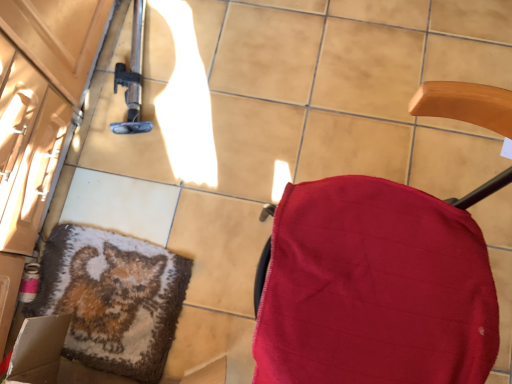
What is the approximate height of red fabric chair at right?

red fabric chair at right is 27.88 inches tall.

What do you see at coordinates (375, 290) in the screenshot? The height and width of the screenshot is (384, 512). I see `red fabric chair at right` at bounding box center [375, 290].

You are a GUI agent. You are given a task and a screenshot of the screen. Output one action in this format:
    pyautogui.click(x=<x>, y=<y>)
    Task: Click on the red fabric chair at right
    
    Given the screenshot: What is the action you would take?
    pyautogui.click(x=375, y=290)

Where is `fluffy woolen mat at lower left`? Image resolution: width=512 pixels, height=384 pixels. fluffy woolen mat at lower left is located at coordinates (112, 299).

Describe the element at coordinates (112, 299) in the screenshot. The height and width of the screenshot is (384, 512). I see `fluffy woolen mat at lower left` at that location.

This screenshot has width=512, height=384. I want to click on red fabric chair at right, so click(375, 290).

Between fluffy woolen mat at lower left and red fabric chair at right, which one appears on the right side from the viewer's perspective?

From the viewer's perspective, red fabric chair at right appears more on the right side.

Considering the positions of objects fluffy woolen mat at lower left and red fabric chair at right in the image provided, who is behind, fluffy woolen mat at lower left or red fabric chair at right?

Positioned behind is fluffy woolen mat at lower left.

Which is closer, (184, 262) or (466, 368)?

The point (466, 368) is closer.

From the image's perspective, which is below, fluffy woolen mat at lower left or red fabric chair at right?

fluffy woolen mat at lower left, from the image's perspective.

From a real-world perspective, is fluffy woolen mat at lower left over red fabric chair at right?

Actually, fluffy woolen mat at lower left is physically below red fabric chair at right in the real world.

Is fluffy woolen mat at lower left thinner than red fabric chair at right?

Yes, fluffy woolen mat at lower left is thinner than red fabric chair at right.

Does fluffy woolen mat at lower left have a greater height compared to red fabric chair at right?

No, fluffy woolen mat at lower left is not taller than red fabric chair at right.

Who is smaller, fluffy woolen mat at lower left or red fabric chair at right?

Smaller between the two is fluffy woolen mat at lower left.

Based on the photo, is fluffy woolen mat at lower left positioned beyond the bounds of red fabric chair at right?

That's correct, fluffy woolen mat at lower left is outside of red fabric chair at right.

Is fluffy woolen mat at lower left not close to red fabric chair at right?

No, fluffy woolen mat at lower left is not far away from red fabric chair at right.

Is fluffy woolen mat at lower left aimed at red fabric chair at right?

Yes.

Find the location of a particular element. Image resolution: width=512 pixels, height=384 pixels. mat located behind the red fabric chair at right is located at coordinates (112, 299).

Would you say red fabric chair at right is to the left or to the right of fluffy woolen mat at lower left in the picture?

Clearly, red fabric chair at right is on the right of fluffy woolen mat at lower left in the image.

Is red fabric chair at right positioned in front of fluffy woolen mat at lower left?

Yes, it is in front of fluffy woolen mat at lower left.

Which is further, (337, 214) or (154, 336)?

The point (154, 336) is more distant.

Looking at this image, from the image's perspective, is red fabric chair at right below fluffy woolen mat at lower left?

No, from the image's perspective, red fabric chair at right is not beneath fluffy woolen mat at lower left.

From a real-world perspective, between red fabric chair at right and fluffy woolen mat at lower left, who is vertically lower?

From a 3D spatial view, fluffy woolen mat at lower left is below.

Considering the sizes of objects red fabric chair at right and fluffy woolen mat at lower left in the image provided, who is thinner, red fabric chair at right or fluffy woolen mat at lower left?

Thinner between the two is fluffy woolen mat at lower left.

Consider the image. Is red fabric chair at right taller or shorter than fluffy woolen mat at lower left?

Clearly, red fabric chair at right is taller compared to fluffy woolen mat at lower left.

Is red fabric chair at right bigger than fluffy woolen mat at lower left?

Yes.

Is red fabric chair at right located outside fluffy woolen mat at lower left?

That's correct, red fabric chair at right is outside of fluffy woolen mat at lower left.

Would you say red fabric chair at right is a long distance from fluffy woolen mat at lower left?

red fabric chair at right is actually quite close to fluffy woolen mat at lower left.

Is red fabric chair at right oriented away from fluffy woolen mat at lower left?

That's not correct — red fabric chair at right is not looking away from fluffy woolen mat at lower left.

Locate an element on the screen. furniture that appears above the fluffy woolen mat at lower left (from the image's perspective) is located at coordinates (375, 290).

Locate an element on the screen. This screenshot has width=512, height=384. furniture that is on the right side of fluffy woolen mat at lower left is located at coordinates (375, 290).

Identify the location of mat lying behind the red fabric chair at right. (112, 299).